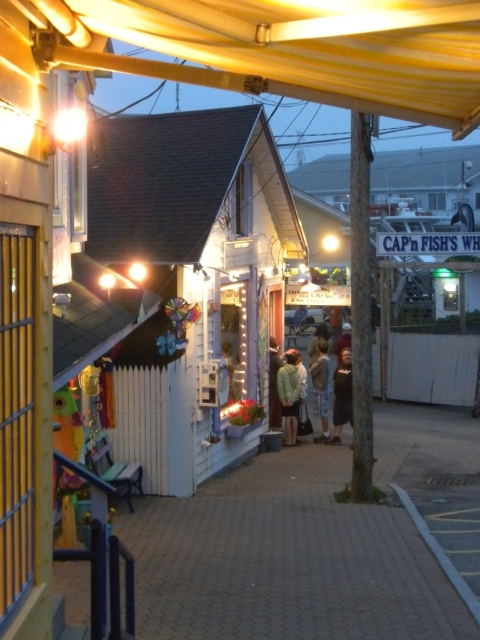
Question: Which point is closer to the camera?

Choices:
 (A) black cotton shirt at center-right
 (B) light brown fabric shirt at center

Answer: (A)

Question: Which point is farther from the camera taking this photo?

Choices:
 (A) (340, 417)
 (B) (317, 394)
 (C) (285, 403)

Answer: (B)

Question: Does white wooden hut at center have a greater width compared to light brown fabric shirt at center?

Choices:
 (A) no
 (B) yes

Answer: (B)

Question: Which of these objects is positioned closest to the green matte jacket at center?

Choices:
 (A) black cotton shirt at center-right
 (B) white wooden hut at center

Answer: (A)

Question: Is black cotton shirt at center-right to the left of light brown fabric shirt at center from the viewer's perspective?

Choices:
 (A) yes
 (B) no

Answer: (B)

Question: Does white wooden hut at center have a larger size compared to black cotton shirt at center-right?

Choices:
 (A) yes
 (B) no

Answer: (A)